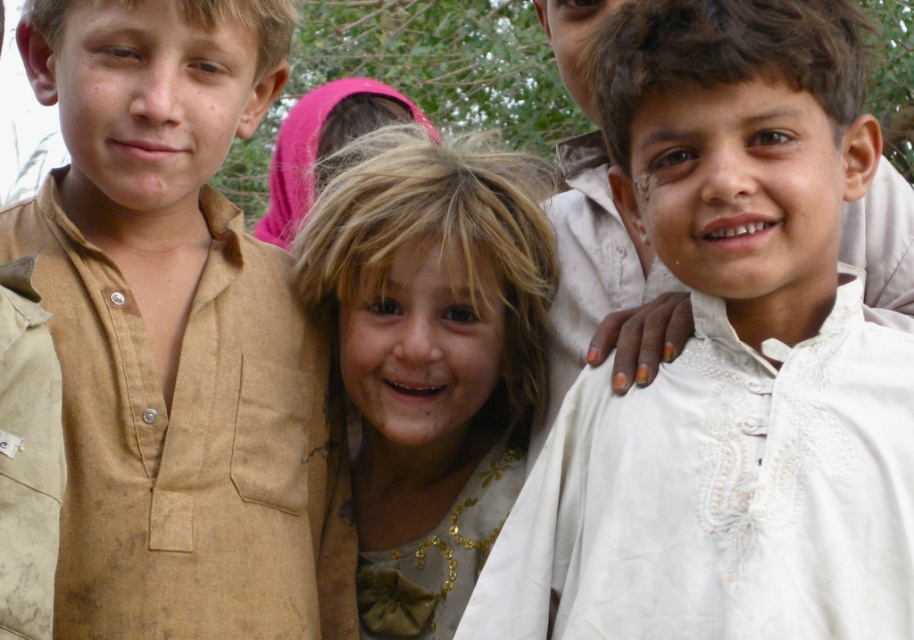
Is white embroidered shirt at center positioned behind brown cotton shirt at left?

No, it is not.

Which is more to the left, white embroidered shirt at center or brown cotton shirt at left?

Positioned to the left is brown cotton shirt at left.

Which is behind, point (675, 26) or point (80, 292)?

Positioned behind is point (80, 292).

Where is `white embroidered shirt at center`? The width and height of the screenshot is (914, 640). white embroidered shirt at center is located at coordinates (728, 364).

Can you confirm if white embroidered shirt at center is thinner than golden sequined dress at center?

Incorrect, white embroidered shirt at center's width is not less than golden sequined dress at center's.

Between white embroidered shirt at center and golden sequined dress at center, which one is positioned higher?

Positioned higher is white embroidered shirt at center.

Measure the distance between point (654, 74) and camera.

Point (654, 74) is 3.07 meters away from camera.

Where is `white embroidered shirt at center`? Image resolution: width=914 pixels, height=640 pixels. white embroidered shirt at center is located at coordinates (728, 364).

Does brown cotton shirt at left have a larger size compared to golden sequined dress at center?

Yes.

Is point (137, 282) positioned after point (390, 620)?

No, (137, 282) is in front of (390, 620).

Does point (195, 104) come behind point (325, 196)?

No, it is not.

The image size is (914, 640). In order to click on brown cotton shirt at left in this screenshot , I will do `click(171, 326)`.